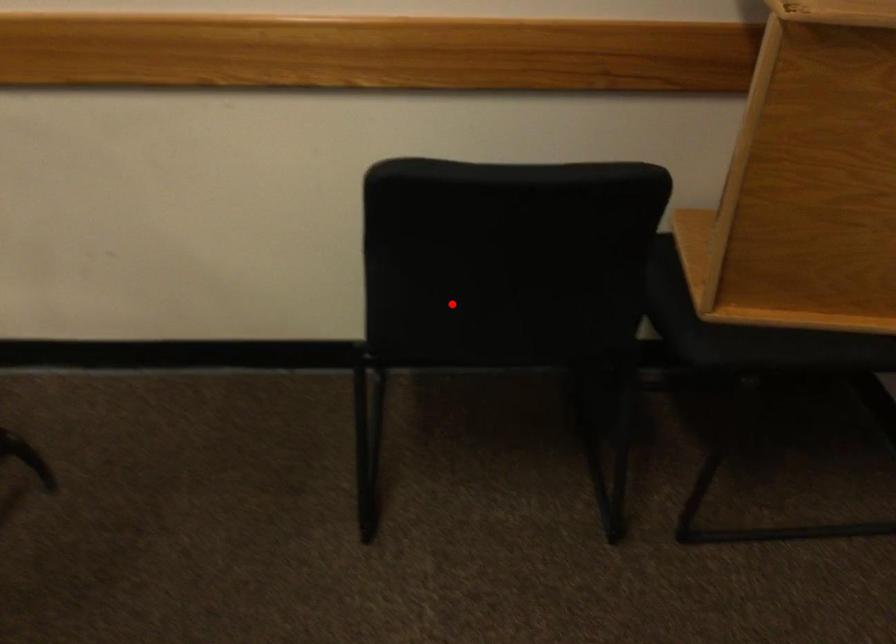
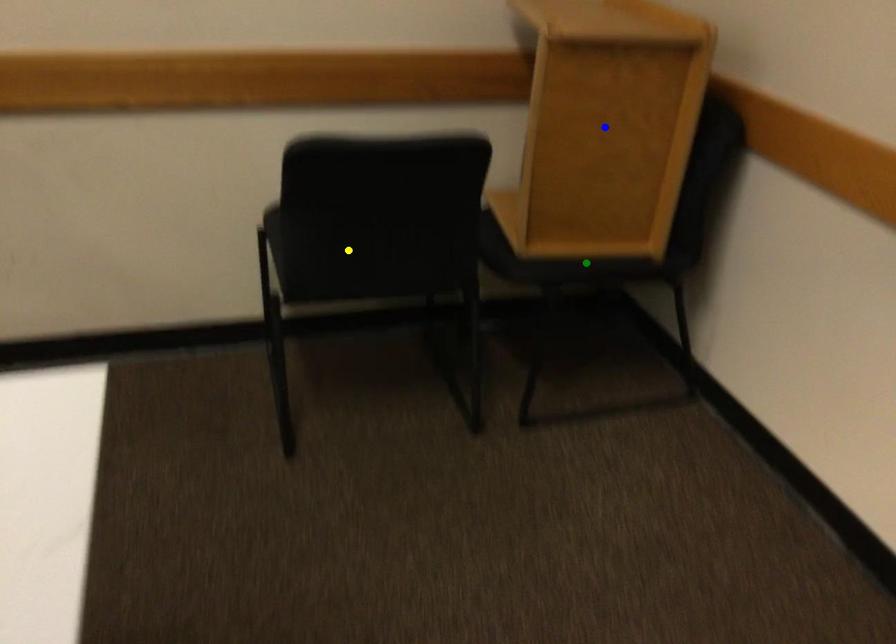
Question: I am providing you with two images of the same scene from different viewpoints. A red point is marked on the first image. You are given multiple points on the second image. In image 2, which mark is for the same physical point as the one in image 1?

Choices:
 (A) yellow point
 (B) blue point
 (C) green point

Answer: (A)